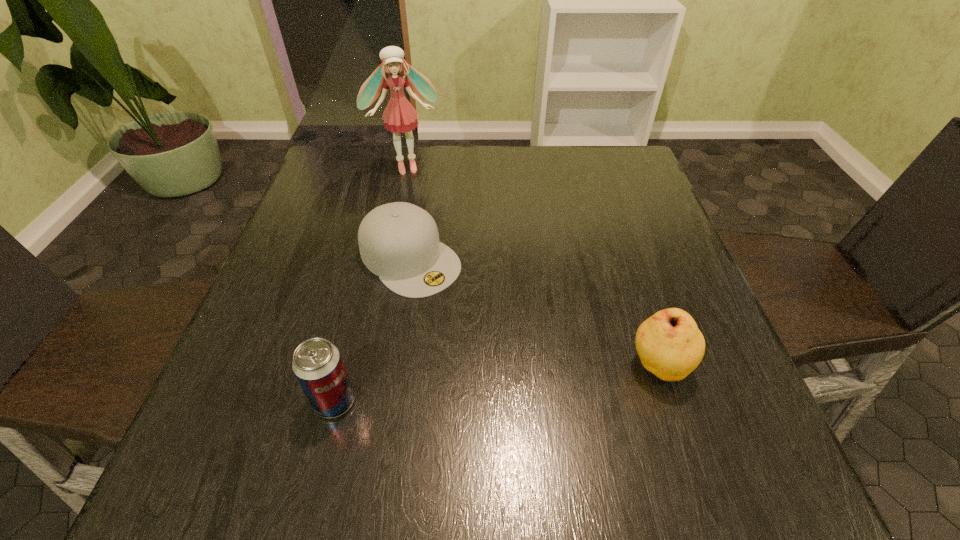
Identify the location of vacant space positioned on the front-facing side of the tallest object. (425, 230).

Find the location of a particular element. free spot located 0.400m on the front-facing side of the cap is located at coordinates (599, 423).

Where is `vacant area situated 0.060m on the front-facing side of the cap`? Image resolution: width=960 pixels, height=540 pixels. vacant area situated 0.060m on the front-facing side of the cap is located at coordinates (462, 304).

This screenshot has height=540, width=960. In order to click on blank space located on the front-facing side of the cap in this screenshot , I will do `click(570, 398)`.

Image resolution: width=960 pixels, height=540 pixels. In order to click on object that is positioned at the far edge in this screenshot , I will do `click(399, 116)`.

Where is `beer can located in the near edge section of the desktop`? beer can located in the near edge section of the desktop is located at coordinates (317, 364).

The width and height of the screenshot is (960, 540). Identify the location of pear present at the near edge. (670, 345).

I want to click on object that is at the left edge, so click(x=399, y=116).

Where is `object at the right edge`? object at the right edge is located at coordinates (670, 345).

Locate an element on the screen. object that is at the far left corner is located at coordinates (399, 116).